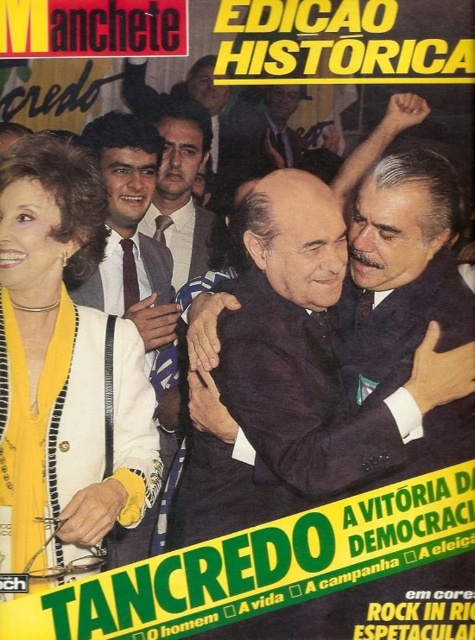
Question: Does dark suit at center come behind yellow fabric at left?

Choices:
 (A) no
 (B) yes

Answer: (B)

Question: Considering the relative positions of yellow fabric at left and dark brown tie at left in the image provided, where is yellow fabric at left located with respect to dark brown tie at left?

Choices:
 (A) right
 (B) left

Answer: (B)

Question: Does dark suit at center appear on the left side of matte black suit at center?

Choices:
 (A) no
 (B) yes

Answer: (A)

Question: Which of the following is the farthest from the observer?

Choices:
 (A) matte black suit at center
 (B) dark brown tie at left

Answer: (A)

Question: Which object appears farthest from the camera in this image?

Choices:
 (A) dark brown tie at left
 (B) matte black suit at center
 (C) dark suit at center
 (D) yellow fabric at left

Answer: (B)

Question: Which point is farther to the camera?

Choices:
 (A) dark brown tie at left
 (B) matte black suit at center
 (C) yellow fabric at left
 (D) dark suit at center

Answer: (B)